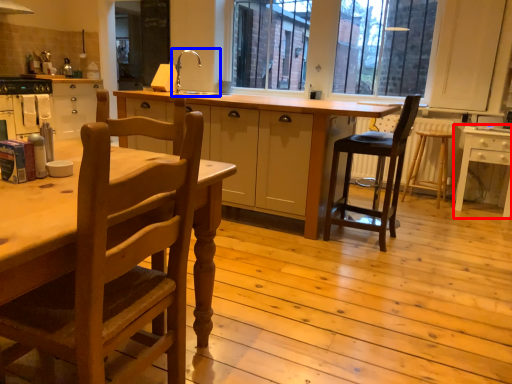
Question: Which object appears closest to the camera in this image, table (highlighted by a red box) or sink (highlighted by a blue box)?

Choices:
 (A) table
 (B) sink

Answer: (A)